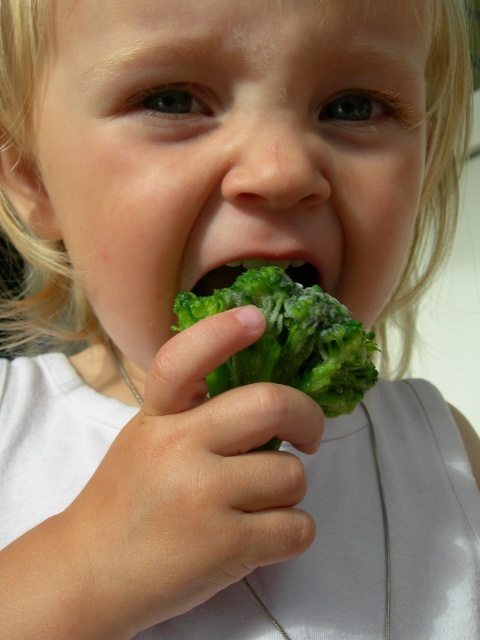
Does point (219, 305) come behind point (311, 262)?

No.

Identify the location of green matte broccoli at center. (289, 339).